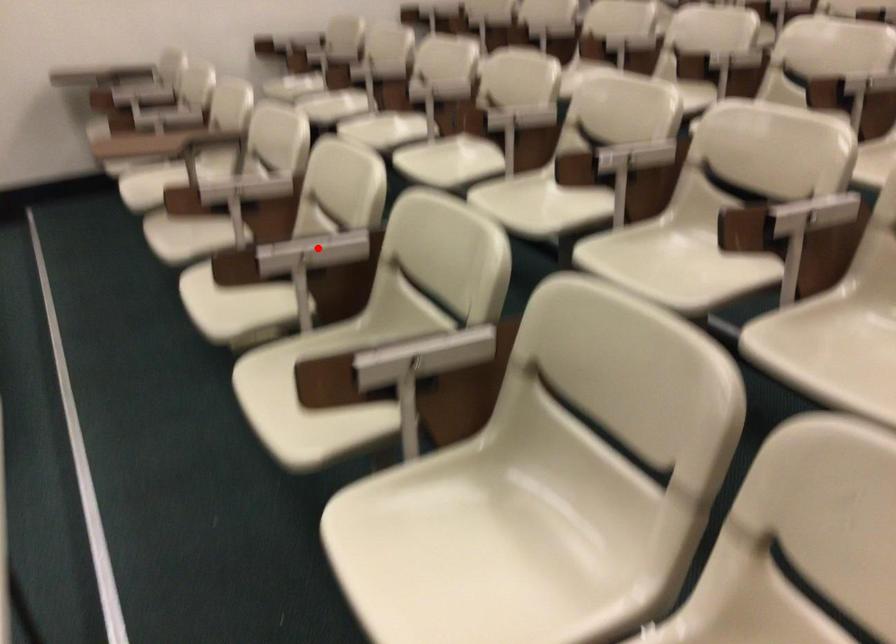
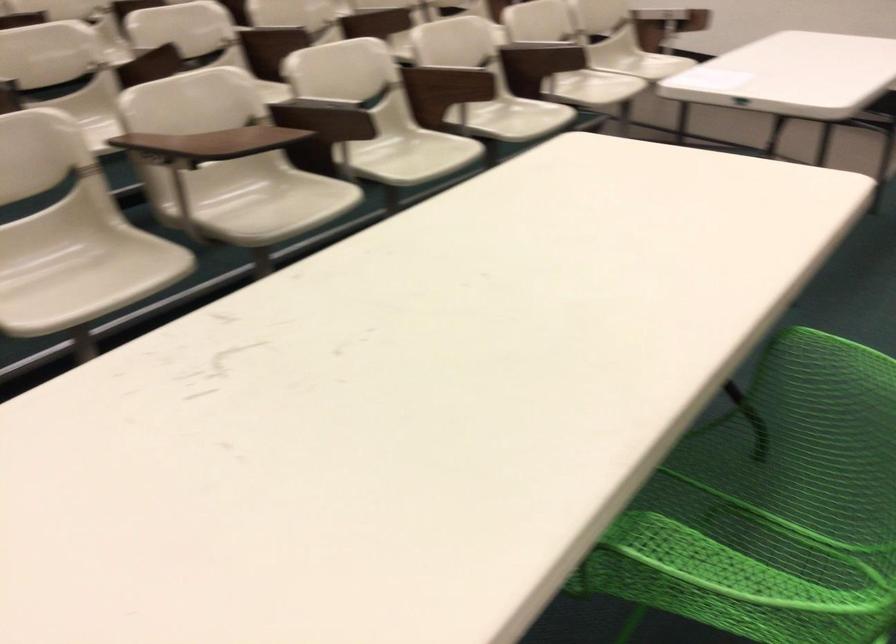
Question: I am providing you with two images of the same scene from different viewpoints. Given a red point in image1, look at the same physical point in image2. Is it:

Choices:
 (A) Closer to the viewpoint
 (B) Farther from the viewpoint

Answer: (B)